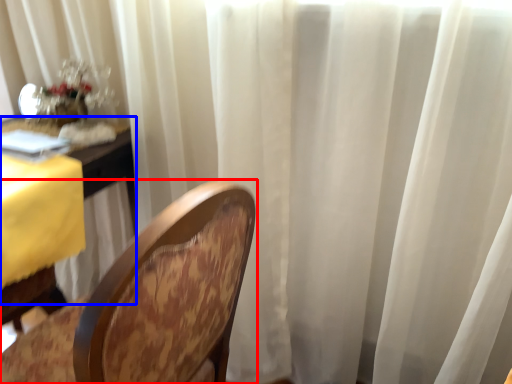
Question: Among these objects, which one is farthest to the camera, chair (highlighted by a red box) or table (highlighted by a blue box)?

Choices:
 (A) chair
 (B) table

Answer: (B)